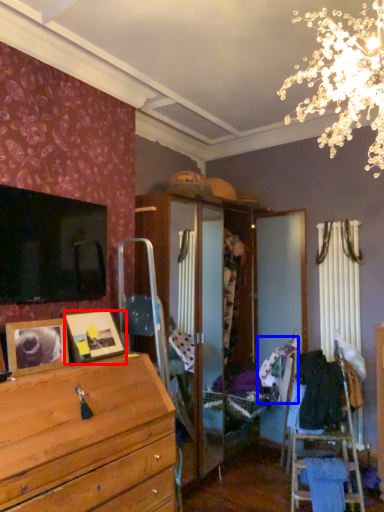
Question: Which object is further to the camera taking this photo, picture frame (highlighted by a red box) or clothing (highlighted by a blue box)?

Choices:
 (A) picture frame
 (B) clothing

Answer: (B)